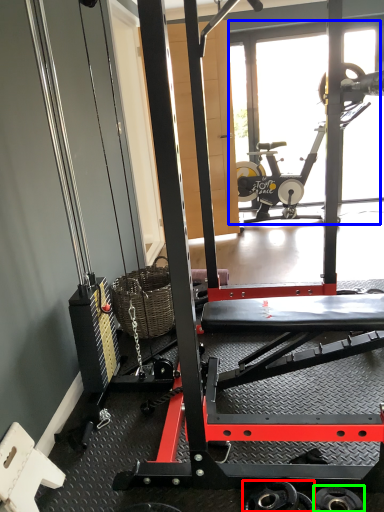
Question: Which object is positioned farthest from wheel (highlighted by a red box)? Select from glass door (highlighted by a blue box) and wheel (highlighted by a green box).

Choices:
 (A) glass door
 (B) wheel

Answer: (A)